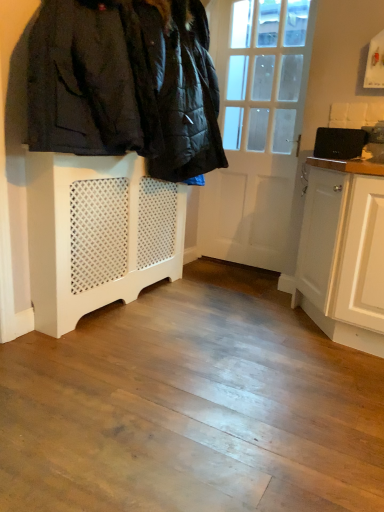
Find the location of a particular element. This screenshot has height=512, width=384. vacant space in white painted wood radiator at lower left (from a real-world perspective) is located at coordinates (135, 296).